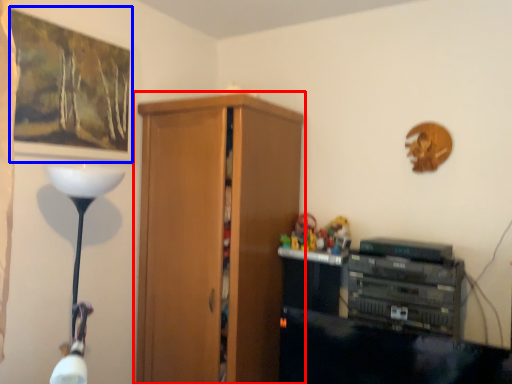
Question: Among these objects, which one is nearest to the camera, cupboard (highlighted by a red box) or picture frame (highlighted by a blue box)?

Choices:
 (A) cupboard
 (B) picture frame

Answer: (B)